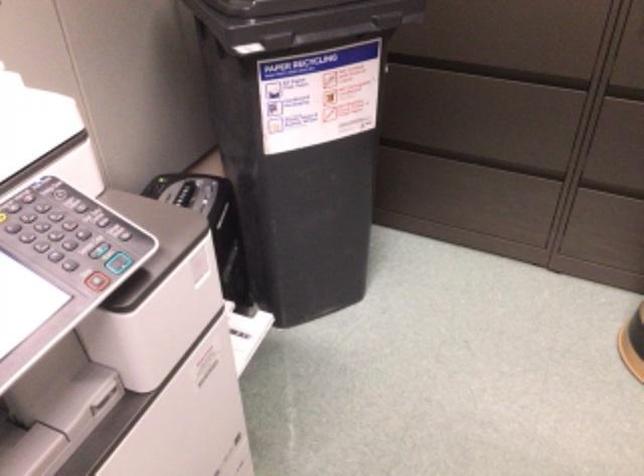
What do you see at coordinates (96, 280) in the screenshot? I see `a red stop button` at bounding box center [96, 280].